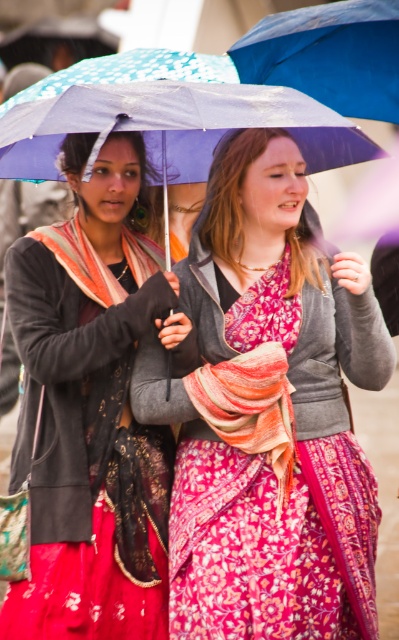
From the picture: Who is shorter, matte purple umbrella at center or matte black scarf at left?

matte black scarf at left is shorter.

Which is more to the left, matte purple umbrella at center or matte black scarf at left?

From the viewer's perspective, matte black scarf at left appears more on the left side.

What do you see at coordinates (268, 412) in the screenshot?
I see `matte purple umbrella at center` at bounding box center [268, 412].

This screenshot has width=399, height=640. What are the coordinates of `matte purple umbrella at center` in the screenshot? It's located at (268, 412).

Is matte purple umbrella at center shorter than blue fabric umbrella at upper center?

Incorrect, matte purple umbrella at center's height does not fall short of blue fabric umbrella at upper center's.

Does matte purple umbrella at center appear on the right side of blue fabric umbrella at upper center?

Incorrect, matte purple umbrella at center is not on the right side of blue fabric umbrella at upper center.

Is point (264, 214) closer to viewer compared to point (286, 74)?

Yes.

Identify the location of matte purple umbrella at center. (268, 412).

Image resolution: width=399 pixels, height=640 pixels. Describe the element at coordinates (92, 410) in the screenshot. I see `matte black scarf at left` at that location.

Can you confirm if matte black scarf at left is positioned to the right of blue fabric umbrella at upper center?

No, matte black scarf at left is not to the right of blue fabric umbrella at upper center.

I want to click on matte black scarf at left, so click(x=92, y=410).

In order to click on matte black scarf at left in this screenshot , I will do `click(92, 410)`.